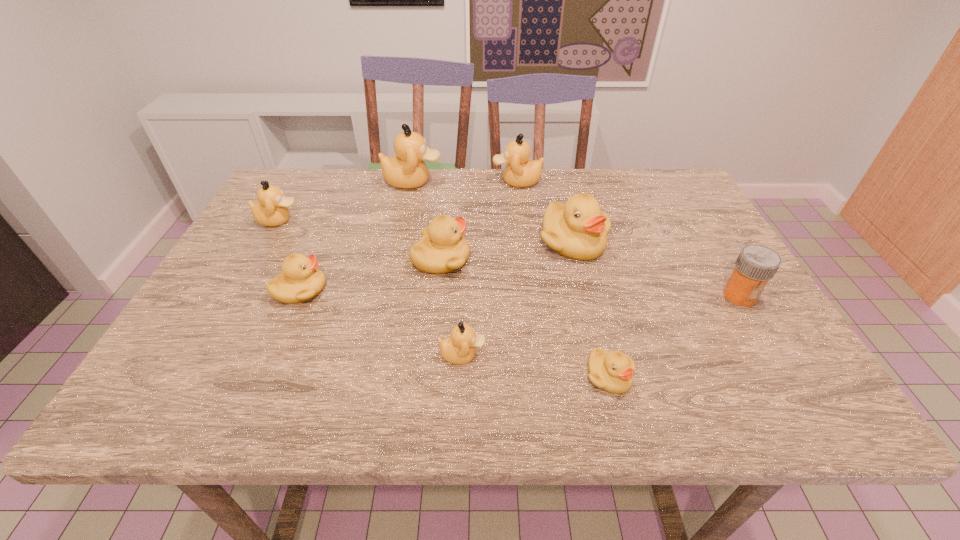
At what (x,y) coordinates should I click in order to perform the action: click on the tallest object. Please return your answer as a coordinate pair (x, y). Looking at the image, I should click on (407, 170).

You are a GUI agent. You are given a task and a screenshot of the screen. Output one action in this format:
    pyautogui.click(x=<x>, y=<y>)
    Task: Click on the biggest tan duckling
    The width and height of the screenshot is (960, 540).
    Given the screenshot: What is the action you would take?
    pyautogui.click(x=407, y=170)

You are a GUI agent. You are given a task and a screenshot of the screen. Output one action in this format:
    pyautogui.click(x=<x>, y=<y>)
    Task: Click on the third smallest tan duckling
    This screenshot has height=540, width=960.
    Given the screenshot: What is the action you would take?
    pyautogui.click(x=519, y=172)

Locate an element on the screen. The height and width of the screenshot is (540, 960). the biggest yellow duckling is located at coordinates (578, 230).

Locate an element on the screen. The height and width of the screenshot is (540, 960). the third biggest tan duckling is located at coordinates (271, 209).

You are a GUI agent. You are given a task and a screenshot of the screen. Output one action in this format:
    pyautogui.click(x=<x>, y=<y>)
    Task: Click on the third farthest tan duckling
    The width and height of the screenshot is (960, 540).
    Given the screenshot: What is the action you would take?
    tap(271, 209)

Locate an element on the screen. The height and width of the screenshot is (540, 960). the third smallest yellow duckling is located at coordinates (442, 249).

Locate an element on the screen. This screenshot has width=960, height=540. orange medicine is located at coordinates coord(756,264).

Identify the location of the rightmost object. (756, 264).

Find the location of a particular element. Image resolution: width=960 pixels, height=540 pixels. the seventh duckling from right to left is located at coordinates 300,280.